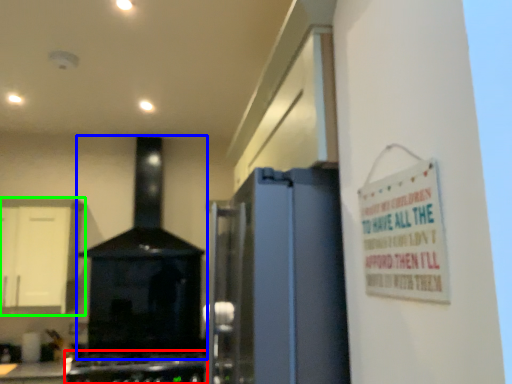
Question: Which object is the closest to the gas stove (highlighted by a red box)? Choose among these: home appliance (highlighted by a blue box) or cabinetry (highlighted by a green box).

Choices:
 (A) home appliance
 (B) cabinetry

Answer: (A)